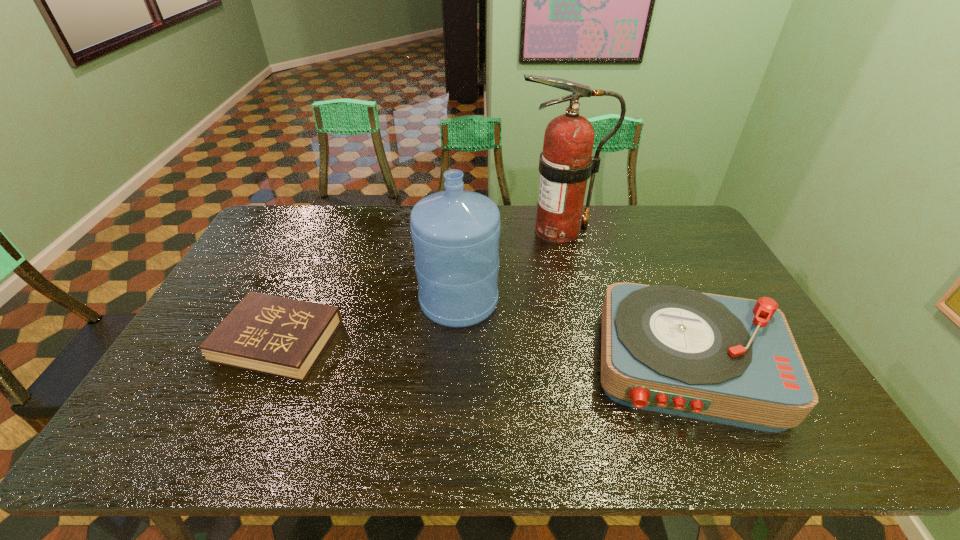
Locate an element on the screen. free space located on the side of the third shortest object with the handle is located at coordinates (462, 237).

You are a GUI agent. You are given a task and a screenshot of the screen. Output one action in this format:
    pyautogui.click(x=<x>, y=<y>)
    Task: Click on the vacant area situated on the side of the third shortest object with the handle
    
    Given the screenshot: What is the action you would take?
    pyautogui.click(x=464, y=215)

I want to click on free space located 0.360m on the side of the third shortest object with the handle, so click(x=464, y=213).

You are a GUI agent. You are given a task and a screenshot of the screen. Output one action in this format:
    pyautogui.click(x=<x>, y=<y>)
    Task: Click on the free space located 0.360m on the left of the record player
    Image resolution: width=960 pixels, height=540 pixels.
    Given the screenshot: What is the action you would take?
    pyautogui.click(x=454, y=363)

Image resolution: width=960 pixels, height=540 pixels. In order to click on free space located 0.080m on the left of the hardback book in this screenshot , I will do `click(190, 341)`.

Find the location of `object at the far edge`. object at the far edge is located at coordinates (566, 163).

The width and height of the screenshot is (960, 540). Find the location of `object at the near edge`. object at the near edge is located at coordinates (664, 348).

What are the coordinates of `object situated at the left edge` in the screenshot? It's located at (279, 336).

At what (x,y) coordinates should I click in order to perform the action: click on object that is at the right edge. Please return your answer as a coordinate pair (x, y). Image resolution: width=960 pixels, height=540 pixels. Looking at the image, I should click on (664, 348).

This screenshot has height=540, width=960. Identify the location of object at the near right corner. (664, 348).